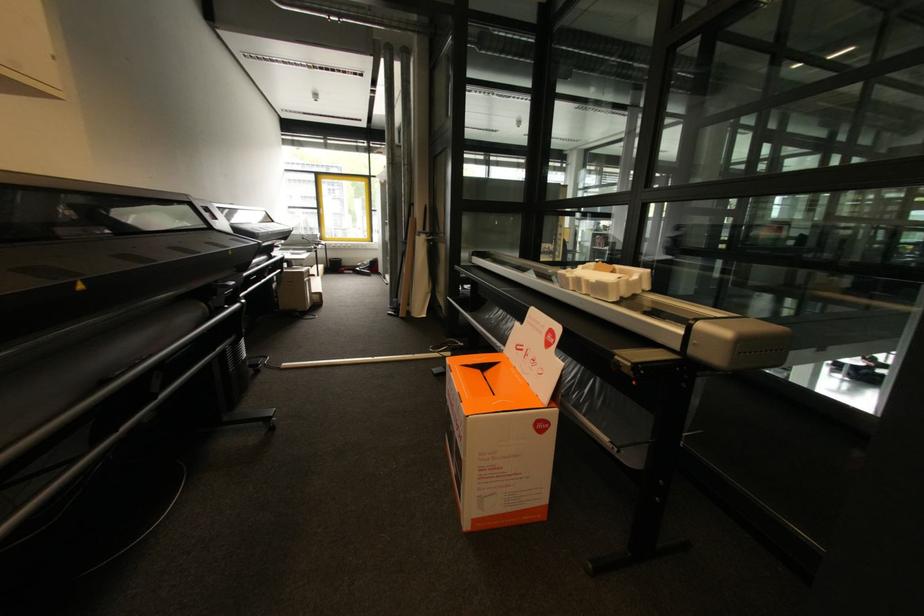
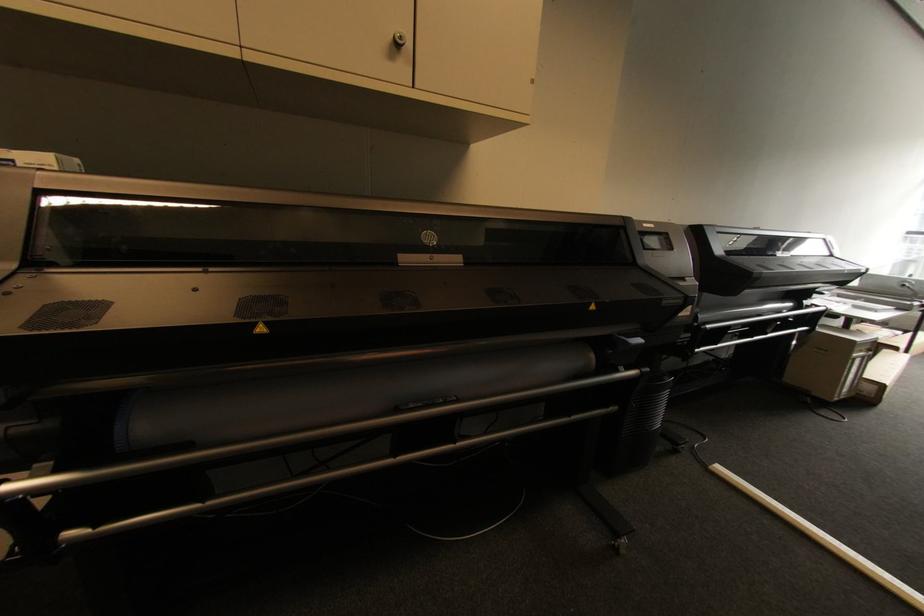
The point at [289,365] is marked in the first image. Where is the corresponding point in the second image?

(723, 469)